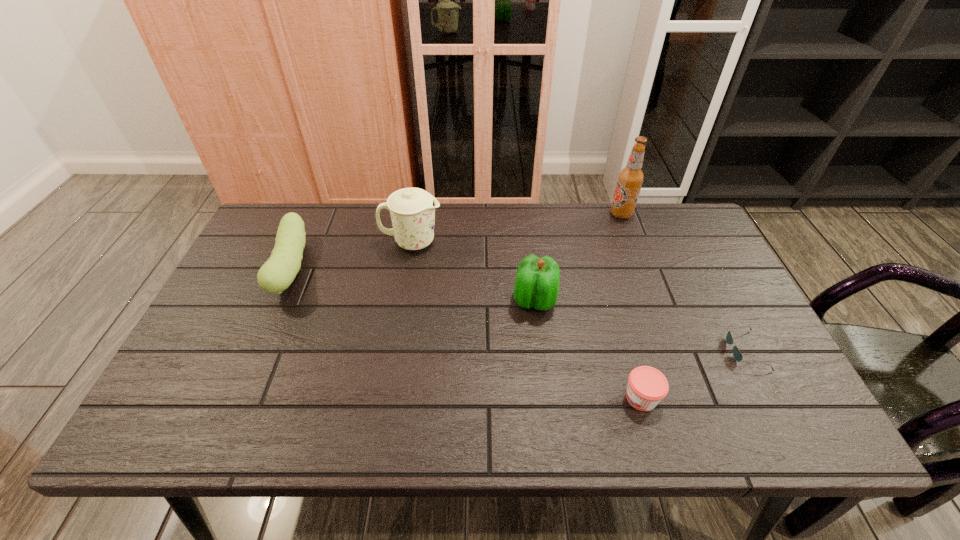
Identify the location of vacant space in between the third object from right to left and the fifth farthest object. (693, 374).

Locate an element on the screen. This screenshot has height=540, width=960. free space between the cucumber and the fifth object from left to right is located at coordinates (457, 241).

Image resolution: width=960 pixels, height=540 pixels. In order to click on free space between the third object from left to right and the second tallest object in this screenshot , I will do `click(473, 271)`.

Locate an element on the screen. Image resolution: width=960 pixels, height=540 pixels. vacant point located between the chinaware and the farthest object is located at coordinates (516, 228).

Identify the location of vacant area that lies between the leftmost object and the bell pepper. (414, 284).

At what (x,y) coordinates should I click in order to perform the action: click on vacant region between the third object from left to right and the fifth tallest object. Please return your answer as a coordinate pair (x, y). The image size is (960, 540). Looking at the image, I should click on (588, 349).

Choose which object is the fourth nearest neighbor to the fifth object from right to left. Please provide its 2D coordinates. Your answer should be formatted as a tuple, i.e. [(x, y)], where the tuple contains the x and y coordinates of a point satisfying the conditions above.

[(647, 386)]

Identify which object is the third closest to the farthest object. Please provide its 2D coordinates. Your answer should be formatted as a tuple, i.e. [(x, y)], where the tuple contains the x and y coordinates of a point satisfying the conditions above.

[(412, 210)]

Locate an element on the screen. vacant space that satisfies the following two spatial constraints: 1. on the spout of the fifth object from right to left; 2. on the back side of the third object from left to right is located at coordinates 402,300.